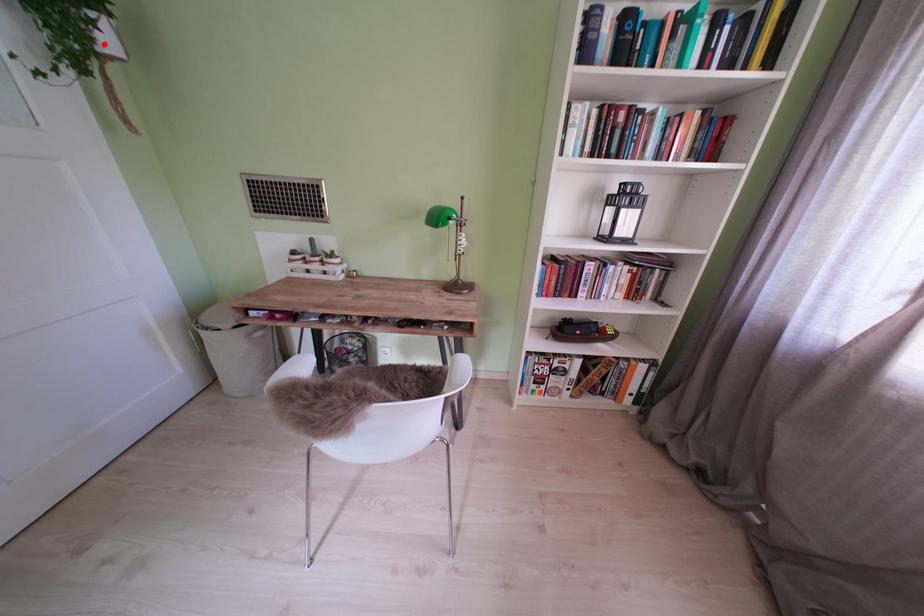
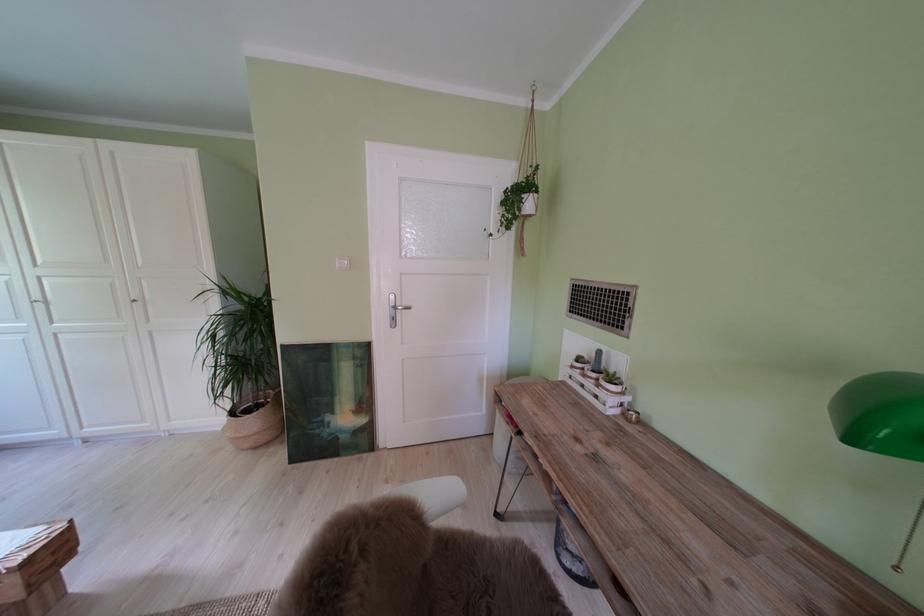
Question: I am providing you with two images of the same scene from different viewpoints. Given a red point in image1, look at the same physical point in image2. Is it:

Choices:
 (A) Closer to the viewpoint
 (B) Farther from the viewpoint

Answer: (A)